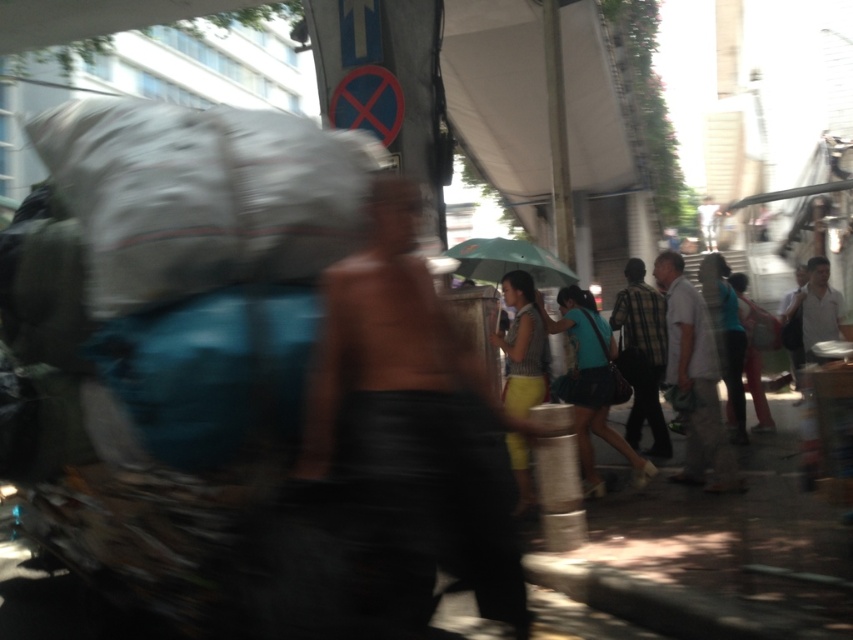
Is blue denim skirt at center further to camera compared to plaid shirt at center?

No, it is not.

Measure the distance between blue denim skirt at center and plaid shirt at center.

blue denim skirt at center and plaid shirt at center are 86.60 centimeters apart.

Who is more forward, (604, 381) or (656, 348)?

Point (604, 381) is in front.

Where is `blue denim skirt at center`? The image size is (853, 640). blue denim skirt at center is located at coordinates (592, 384).

Between black matte shirt at center and plaid shirt at center, which one has less height?

Standing shorter between the two is black matte shirt at center.

Which is above, black matte shirt at center or plaid shirt at center?

black matte shirt at center is above.

You are a GUI agent. You are given a task and a screenshot of the screen. Output one action in this format:
    pyautogui.click(x=<x>, y=<y>)
    Task: Click on the black matte shirt at center
    Image resolution: width=853 pixels, height=640 pixels.
    Given the screenshot: What is the action you would take?
    pyautogui.click(x=410, y=429)

Is striped fabric shirt at center above green matte umbrella at center?

No.

Where is `striped fabric shirt at center`? The height and width of the screenshot is (640, 853). striped fabric shirt at center is located at coordinates (521, 346).